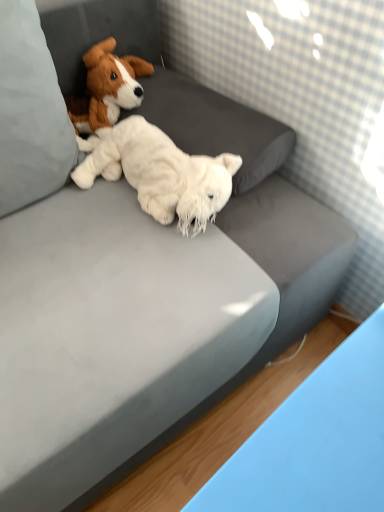
You are a GUI agent. You are given a task and a screenshot of the screen. Output one action in this format:
    pyautogui.click(x=<x>, y=<y>)
    Task: Click on the vacant area in front of white fluffy stuffed animal at center, which ranks as the 1th dog in bottom-to-top order
    
    Given the screenshot: What is the action you would take?
    pyautogui.click(x=125, y=277)